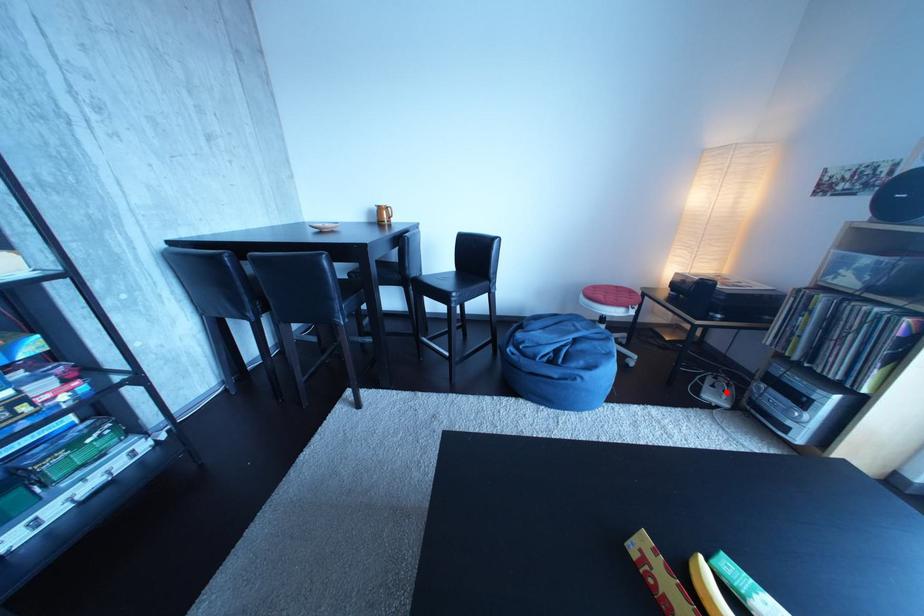
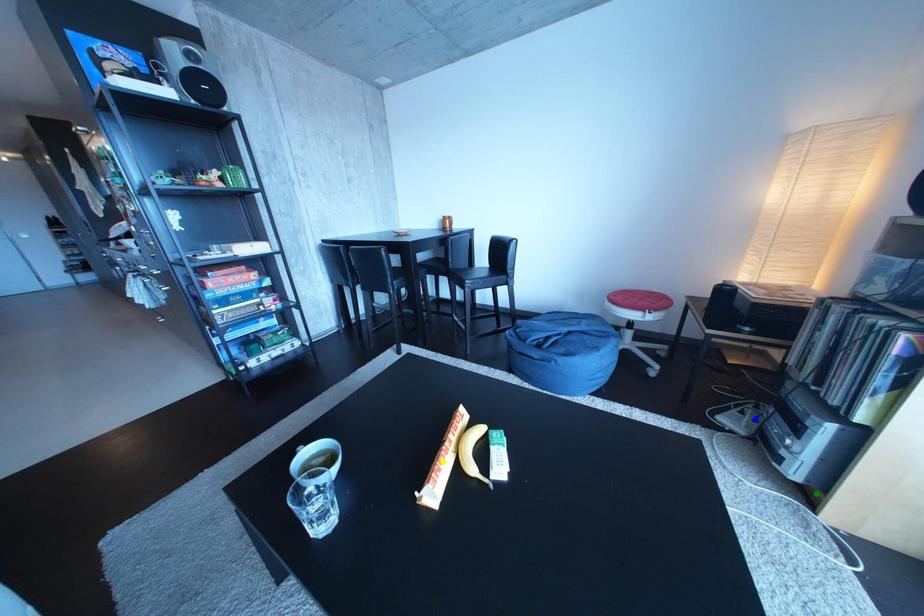
Question: I am providing you with two images of the same scene from different viewpoints. A red point is marked on the first image. You are given multiple points on the second image. Which spot in image 2 lines up with the point in image 1?

Choices:
 (A) green point
 (B) blue point
 (C) yellow point

Answer: (B)